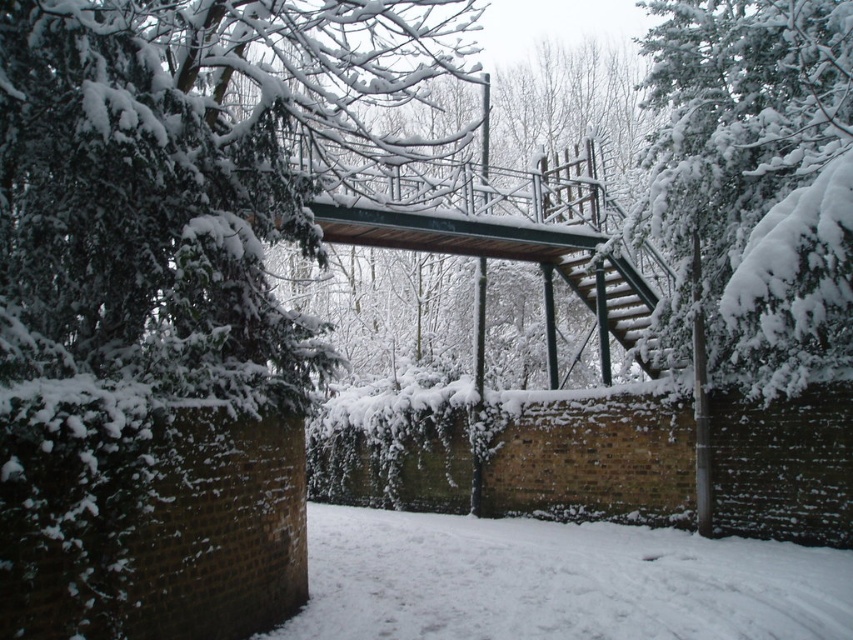
Does white powdery snow at lower center have a larger size compared to metallic green staircase at center right?

No, white powdery snow at lower center is not bigger than metallic green staircase at center right.

Which is in front, point (641, 589) or point (589, 173)?

Point (641, 589)

Locate an element on the screen. white powdery snow at lower center is located at coordinates (558, 580).